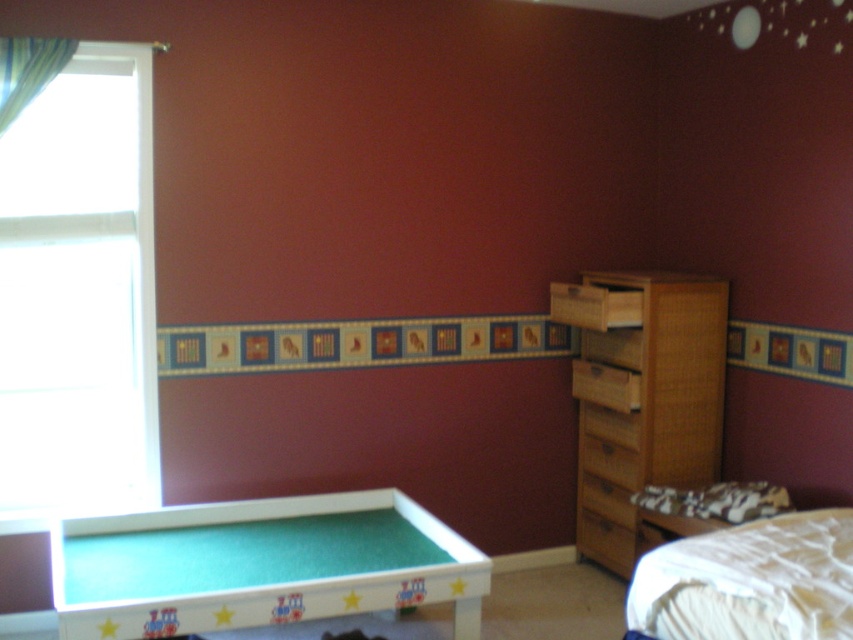
Is white glass window at left below white soft bed at lower right?

No.

Describe the element at coordinates (79, 296) in the screenshot. I see `white glass window at left` at that location.

Locate an element on the screen. This screenshot has height=640, width=853. white glass window at left is located at coordinates [x=79, y=296].

Is point (817, 637) behind point (601, 294)?

No, (817, 637) is in front of (601, 294).

Does white soft bed at lower right appear under woven wood drawer at center right?

Yes, white soft bed at lower right is below woven wood drawer at center right.

Does point (778, 614) come farther from viewer compared to point (589, 314)?

No.

Image resolution: width=853 pixels, height=640 pixels. Find the location of `white soft bed at lower right`. white soft bed at lower right is located at coordinates (749, 580).

Who is lower down, green felt billiard table at lower left or white soft bed at lower right?

green felt billiard table at lower left is lower down.

Which of these two, green felt billiard table at lower left or white soft bed at lower right, stands taller?

green felt billiard table at lower left is taller.

Locate an element on the screen. The height and width of the screenshot is (640, 853). green felt billiard table at lower left is located at coordinates (260, 564).

Identify the location of green felt billiard table at lower left. The width and height of the screenshot is (853, 640). (260, 564).